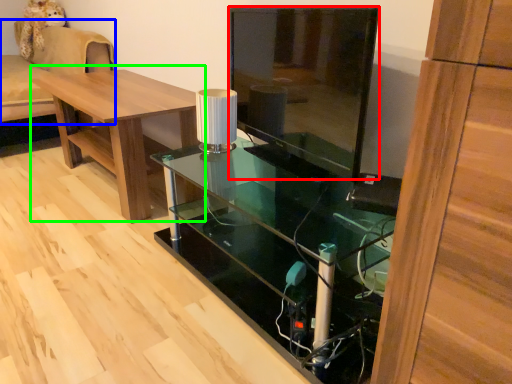
Question: Considering the real-world distances, which object is farthest from glass door (highlighted by a red box)? couch (highlighted by a blue box) or table (highlighted by a green box)?

Choices:
 (A) couch
 (B) table

Answer: (A)